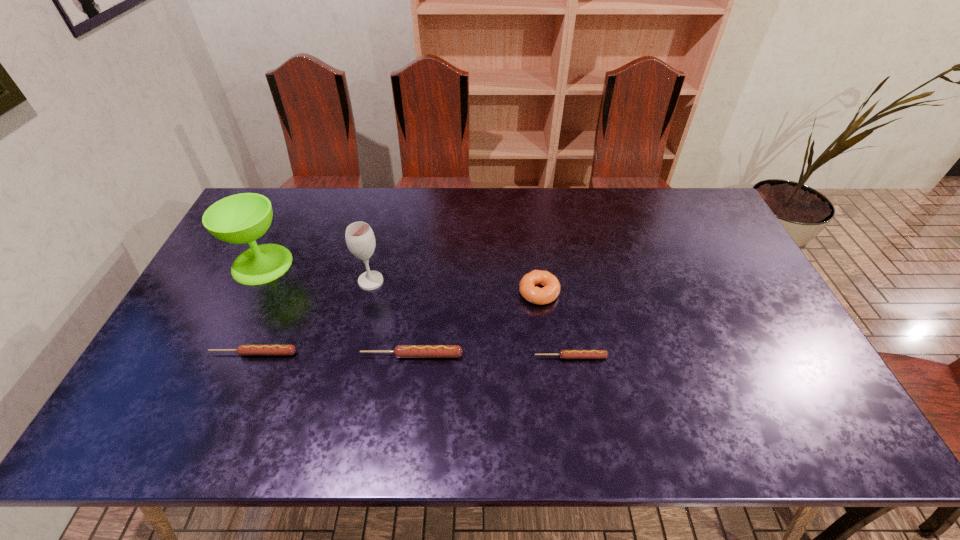
Observe the arrangement of all sausages in the image. To keep them evenly spaced, where would you place another sausage on the right? Please locate a free space. Please provide its 2D coordinates. Your answer should be formatted as a tuple, i.e. [(x, y)], where the tuple contains the x and y coordinates of a point satisfying the conditions above.

[(731, 359)]